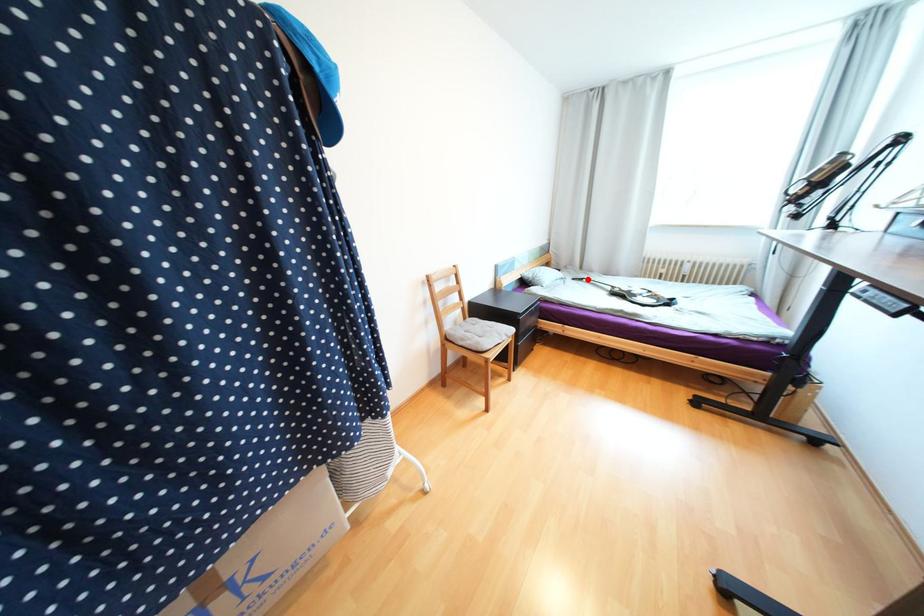
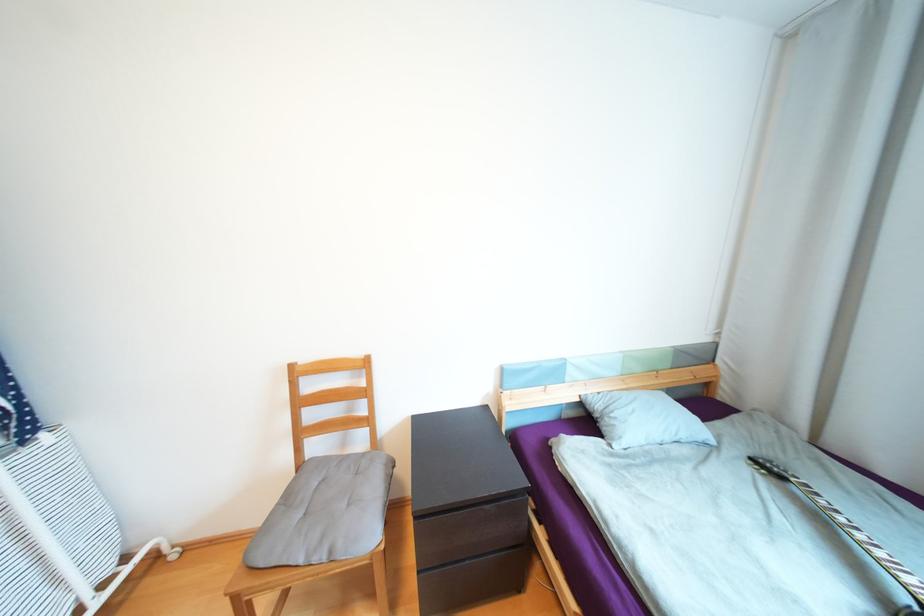
Question: I am providing you with two images of the same scene from different viewpoints. A red point is marked on the first image. Is the red point's position out of view in image 2?

Choices:
 (A) Yes
 (B) No

Answer: (B)